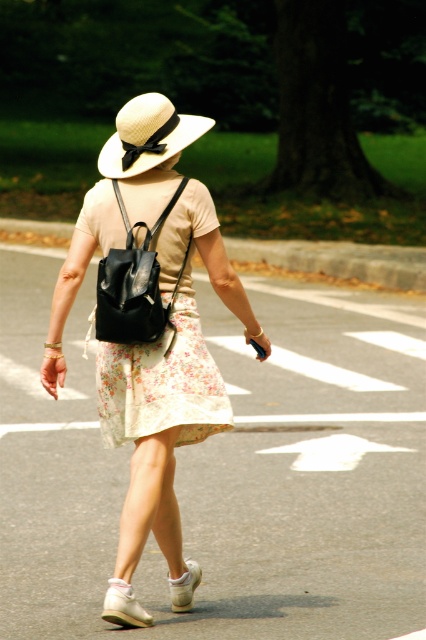
Question: Which object is positioned farthest from the matte black backpack at center?

Choices:
 (A) natural straw hat at upper center
 (B) white suede sneaker at lower center
 (C) white fabric sandal at lower center
 (D) floral cotton dress at center

Answer: (A)

Question: Does matte black backpack at center have a lesser width compared to white suede sneaker at lower center?

Choices:
 (A) no
 (B) yes

Answer: (A)

Question: Which object appears farthest from the camera in this image?

Choices:
 (A) floral cotton dress at center
 (B) white fabric sandal at lower center

Answer: (A)

Question: Is floral cotton dress at center closer to the viewer compared to white fabric sandal at lower center?

Choices:
 (A) yes
 (B) no

Answer: (B)

Question: Does floral cotton dress at center appear over white fabric sandal at lower center?

Choices:
 (A) yes
 (B) no

Answer: (A)

Question: Which object is farther from the camera taking this photo?

Choices:
 (A) white suede sneaker at lower center
 (B) white fabric sandal at lower center
 (C) matte black backpack at center

Answer: (A)